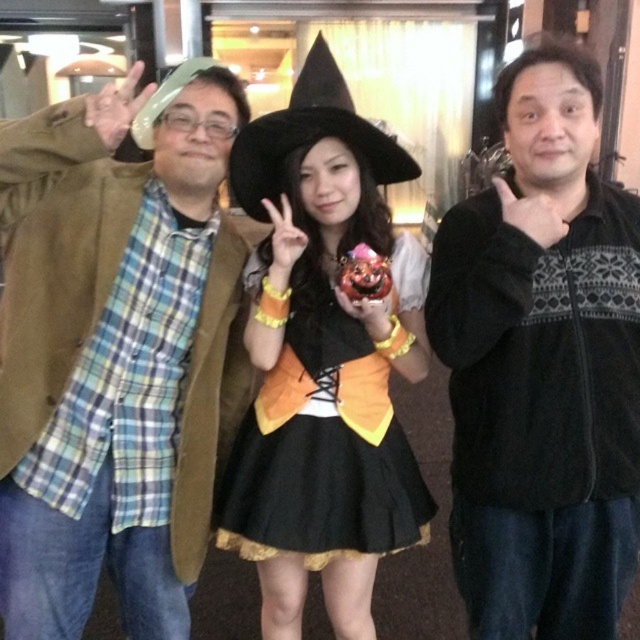
In order to click on brown suede jacket at left in this screenshot , I will do `click(115, 355)`.

Does point (214, 163) come in front of point (337, 401)?

No, it is not.

Identify the location of brown suede jacket at left. This screenshot has width=640, height=640. (115, 355).

Between point (16, 204) and point (554, 620), which one is positioned in front?

Positioned in front is point (16, 204).

Who is positioned more to the right, brown suede jacket at left or black velvety jacket at center?

From the viewer's perspective, black velvety jacket at center appears more on the right side.

Does point (51, 332) come in front of point (536, 576)?

Yes.

Find the location of a particular element. This screenshot has height=640, width=640. brown suede jacket at left is located at coordinates coord(115,355).

Does black velvety jacket at center have a larger size compared to black satin dress at center?

Yes, black velvety jacket at center is bigger than black satin dress at center.

Can you confirm if black velvety jacket at center is positioned to the right of black satin dress at center?

Correct, you'll find black velvety jacket at center to the right of black satin dress at center.

Between point (492, 189) and point (298, 400), which one is positioned behind?

Point (298, 400)

Where is `black velvety jacket at center`? This screenshot has width=640, height=640. black velvety jacket at center is located at coordinates (541, 365).